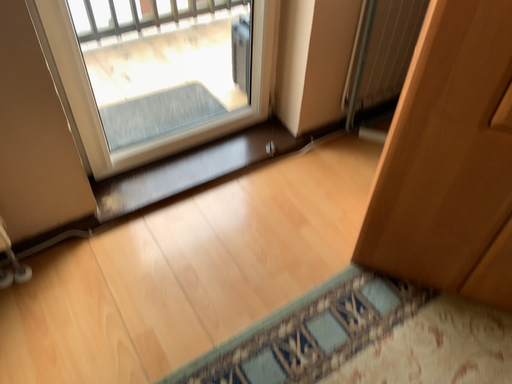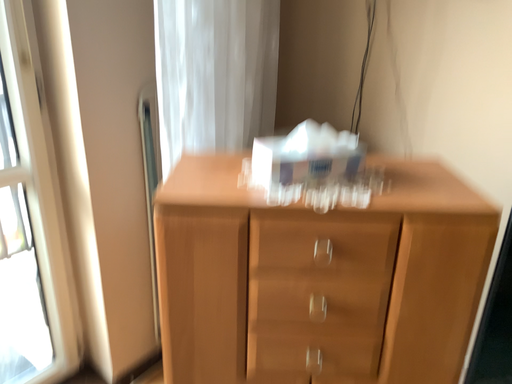
Question: How did the camera likely rotate when shooting the video?

Choices:
 (A) rotated right
 (B) rotated left

Answer: (A)